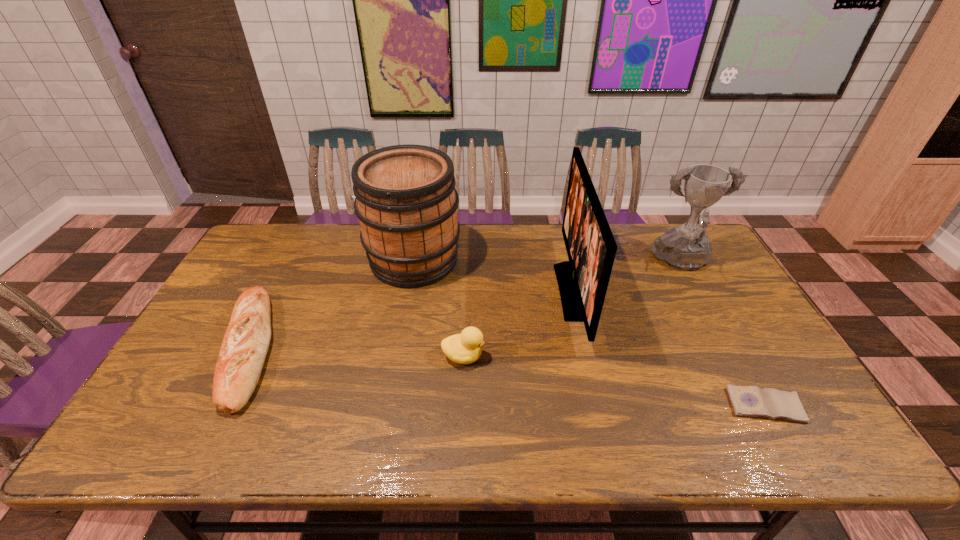
Find the location of `free space located 0.210m on the left of the cider`. free space located 0.210m on the left of the cider is located at coordinates (304, 260).

Where is `free space located 0.300m on the side with emblem of the award`? The image size is (960, 540). free space located 0.300m on the side with emblem of the award is located at coordinates (737, 362).

At what (x,y) coordinates should I click in order to perform the action: click on vacant space located on the front-facing side of the duck. Please return your answer as a coordinate pair (x, y). Looking at the image, I should click on (557, 356).

The width and height of the screenshot is (960, 540). In order to click on vacant space located 0.380m on the right of the fifth tallest object in this screenshot , I will do `click(419, 349)`.

This screenshot has height=540, width=960. Identify the location of vacant area located 0.370m on the left of the diary. (575, 406).

At what (x,y) coordinates should I click in order to perform the action: click on monitor present at the far edge. Please return your answer as a coordinate pair (x, y). Looking at the image, I should click on (591, 248).

The image size is (960, 540). In order to click on cider present at the far edge in this screenshot , I will do `click(405, 199)`.

I want to click on award present at the far edge, so click(x=686, y=247).

Identify the location of object situated at the near edge. (751, 401).

The height and width of the screenshot is (540, 960). What are the coordinates of `object at the left edge` in the screenshot? It's located at (246, 341).